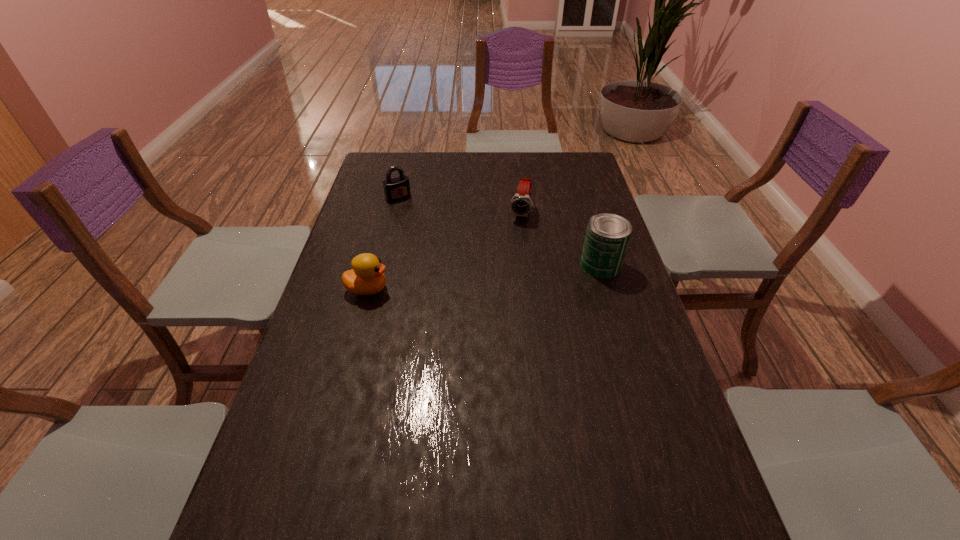
Where is `vacant area that lies between the duckling and the tallest object`? The image size is (960, 540). vacant area that lies between the duckling and the tallest object is located at coordinates (484, 277).

Identify the location of vacant area between the tallest object and the nearest object. The image size is (960, 540). (484, 277).

Locate an element on the screen. The height and width of the screenshot is (540, 960). vacant area that lies between the nearest object and the padlock is located at coordinates (383, 243).

I want to click on object that can be found as the closest to the third nearest object, so click(607, 236).

Locate which object ranks in proximity to the farthest object. Please provide its 2D coordinates. Your answer should be formatted as a tuple, i.e. [(x, y)], where the tuple contains the x and y coordinates of a point satisfying the conditions above.

[(521, 205)]

Locate an element on the screen. vacant region that satisfies the following two spatial constraints: 1. on the front side of the can; 2. on the right side of the padlock is located at coordinates (381, 265).

Where is `vacant space that satisfies the following two spatial constraints: 1. on the front side of the third nearest object; 2. on the right side of the can`? The width and height of the screenshot is (960, 540). vacant space that satisfies the following two spatial constraints: 1. on the front side of the third nearest object; 2. on the right side of the can is located at coordinates (526, 265).